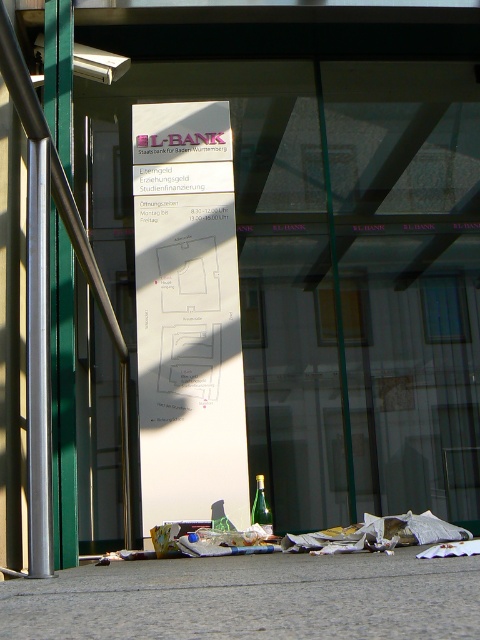
You are a delivery person who needs to place a large package on the counter inside the bank. The counter is near the entrance. However, there is a brushed metal rail at left and a green glass bottle at lower center in the way. Which object is taller, making it more likely to block your delivery cart from passing through?

The brushed metal rail at left is much taller than the green glass bottle at lower center, so it is more likely to block the delivery cart from passing through.

You are standing in front of the building and need to locate the entrance. The silver metallic pole at left and the brushed metal rail at left are both near the entrance. Which one is higher up?

The silver metallic pole at left is above the brushed metal rail at left, so it is higher up.

You are standing in front of the building and want to locate the silver metallic pole at left. According to the scene description, where would you find it?

The silver metallic pole at left is located at the 2D coordinates of point [62,396].